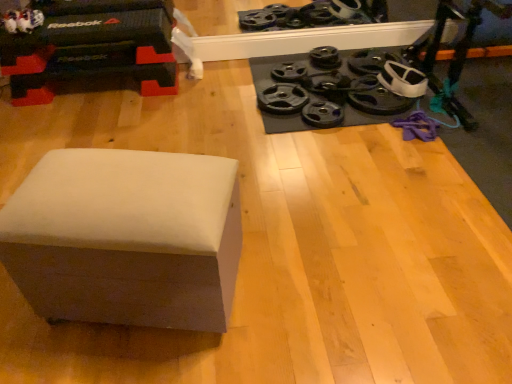
Image resolution: width=512 pixels, height=384 pixels. Find the location of `free space above black rubber weight plate at center-right, which is the fifth wheel from right to left (from a real-world perspective)`. free space above black rubber weight plate at center-right, which is the fifth wheel from right to left (from a real-world perspective) is located at coordinates (324, 107).